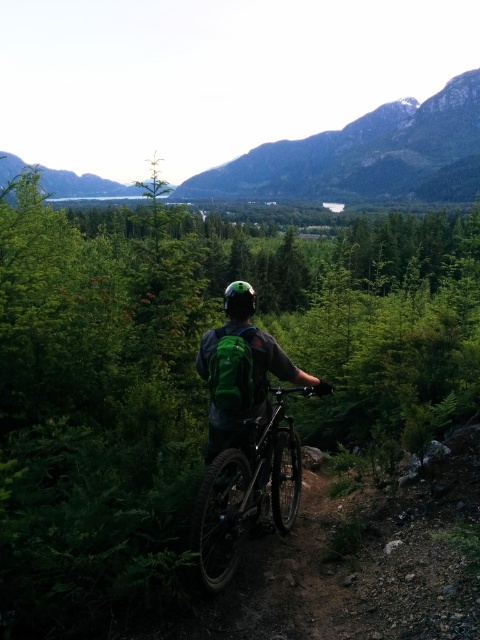
Which of these two, green matte forest at center or shiny metallic bicycle at center, stands shorter?

Standing shorter between the two is shiny metallic bicycle at center.

How distant is green matte forest at center from shiny metallic bicycle at center?

They are 13.77 meters apart.

Which is in front, point (396, 227) or point (251, 458)?

Point (251, 458)

I want to click on green matte forest at center, so click(190, 380).

Between shiny metallic bicycle at center and green matte backpack at center, which one has less height?

With less height is shiny metallic bicycle at center.

Can you confirm if shiny metallic bicycle at center is positioned above green matte backpack at center?

Incorrect, shiny metallic bicycle at center is not positioned above green matte backpack at center.

The height and width of the screenshot is (640, 480). Find the location of `shiny metallic bicycle at center`. shiny metallic bicycle at center is located at coordinates (248, 492).

Describe the element at coordinates (190, 380) in the screenshot. This screenshot has width=480, height=640. I see `green matte forest at center` at that location.

Does green matte forest at center lie in front of green matte backpack at center?

Yes, it is.

Image resolution: width=480 pixels, height=640 pixels. I want to click on green matte forest at center, so click(190, 380).